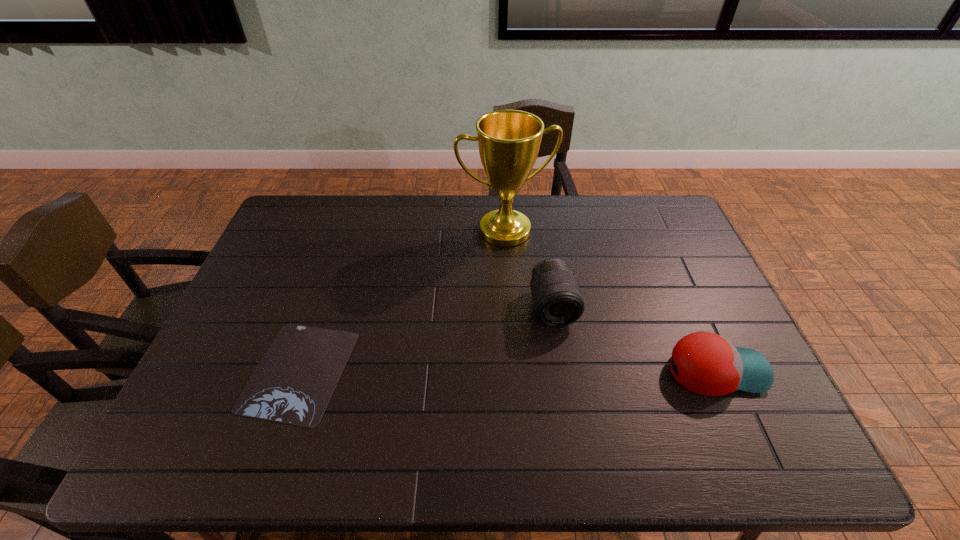
At what (x,y) coordinates should I click in order to perform the action: click on free space located 0.260m on the surface of the telephoto lens. Please return your answer as a coordinate pair (x, y). This screenshot has width=960, height=540. Looking at the image, I should click on (577, 417).

In order to click on free space located 0.250m by the handles of the farthest object in this screenshot , I will do `click(539, 305)`.

Identify the location of free space located by the handles of the farthest object. (533, 293).

Identify the location of vacant space situated by the handles of the farthest object. The image size is (960, 540). (530, 286).

You are a GUI agent. You are given a task and a screenshot of the screen. Output one action in this format:
    pyautogui.click(x=<x>, y=<y>)
    Task: Click on the object that is at the far edge
    The width and height of the screenshot is (960, 540).
    Given the screenshot: What is the action you would take?
    pyautogui.click(x=508, y=140)

In order to click on mousepad that is at the near edge in this screenshot , I will do `click(294, 382)`.

Locate an element on the screen. baseball cap located in the near edge section of the desktop is located at coordinates (708, 364).

Identify the location of object at the left edge. (294, 382).

The image size is (960, 540). I want to click on object positioned at the right edge, so click(708, 364).

The width and height of the screenshot is (960, 540). In order to click on object at the near left corner in this screenshot , I will do `click(294, 382)`.